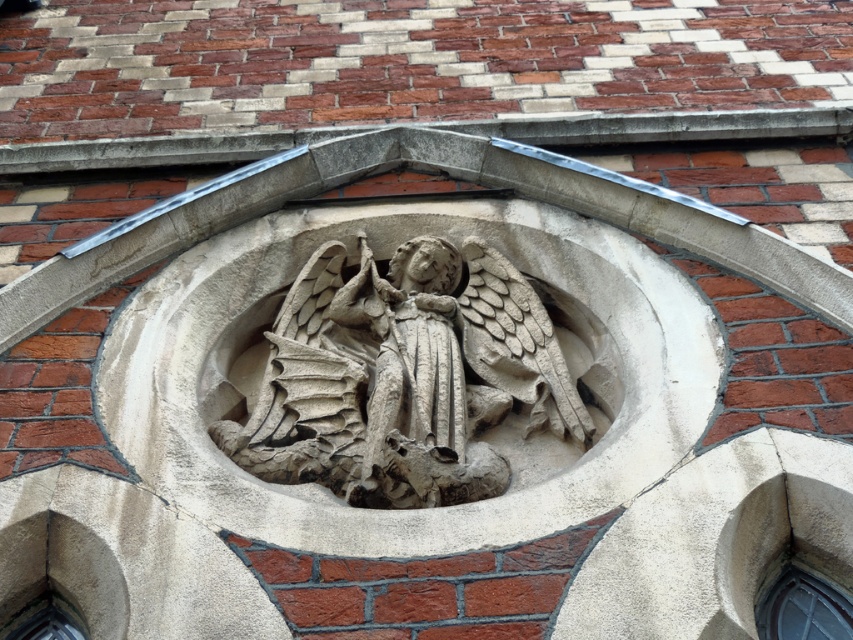
Question: In this image, where is clear glass window at lower right located relative to transparent glass window at lower left?

Choices:
 (A) right
 (B) left

Answer: (A)

Question: Is gray stone angel at center smaller than clear glass window at lower right?

Choices:
 (A) yes
 (B) no

Answer: (B)

Question: Among these objects, which one is nearest to the camera?

Choices:
 (A) transparent glass window at lower left
 (B) clear glass window at lower right
 (C) gray stone angel at center

Answer: (B)

Question: Among these objects, which one is farthest from the camera?

Choices:
 (A) gray stone angel at center
 (B) transparent glass window at lower left

Answer: (A)

Question: Which point is farther to the camera?

Choices:
 (A) (18, 627)
 (B) (252, 410)

Answer: (B)

Question: Can you confirm if gray stone angel at center is thinner than transparent glass window at lower left?

Choices:
 (A) yes
 (B) no

Answer: (B)